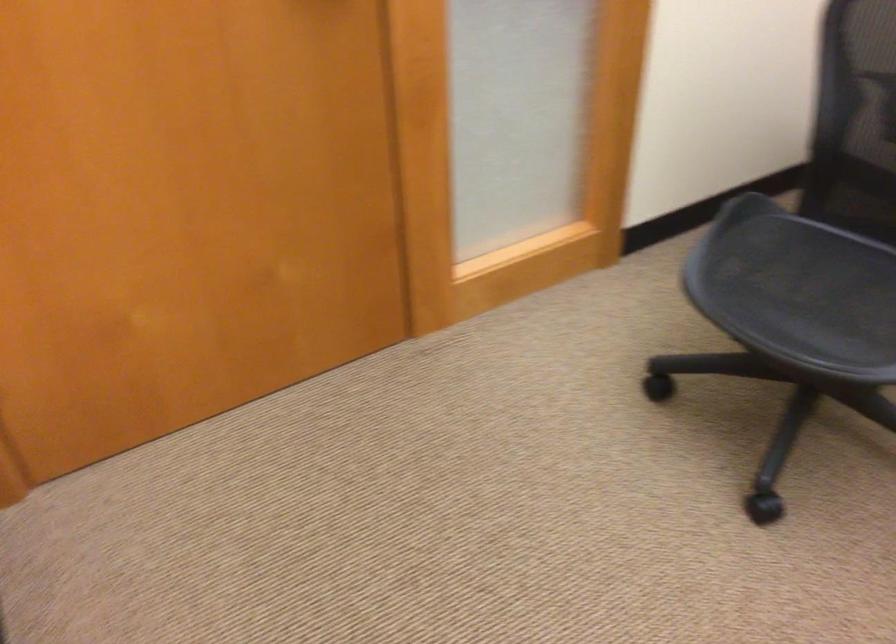
Find where to sit the black chair sitting surface. Please return your answer as a coordinate pair (x, y).

(805, 295)